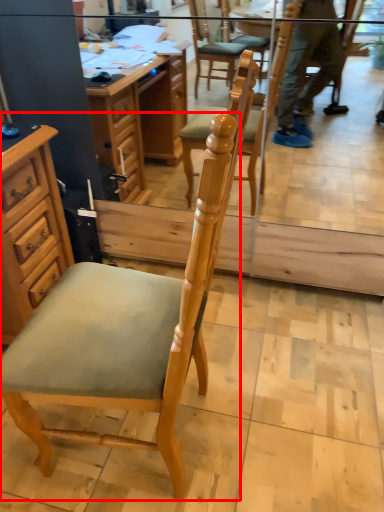
Question: From the image's perspective, considering the relative positions of chair (annotated by the red box) and cabinetry in the image provided, where is chair (annotated by the red box) located with respect to the staircase?

Choices:
 (A) above
 (B) below

Answer: (B)